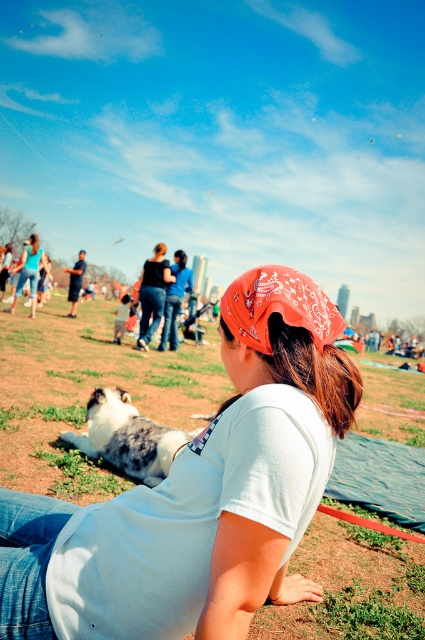
Where is `fluffy gray cat at lower left`? fluffy gray cat at lower left is located at coordinates (127, 436).

Is fluffy gray cat at lower left in front of brown silky hair at center?

No, it is not.

Does point (135, 419) come farther from viewer compared to point (353, 390)?

That is True.

Where is `fluffy gray cat at lower left`? Image resolution: width=425 pixels, height=640 pixels. fluffy gray cat at lower left is located at coordinates (127, 436).

Does point (138, 493) lie in front of point (251, 305)?

Yes, it is.

The image size is (425, 640). Identify the location of white cotton shirt at center. (198, 493).

Identify the location of white cotton shirt at center. The width and height of the screenshot is (425, 640). (198, 493).

Between white cotton shirt at center and brown silky hair at center, which one appears on the right side from the viewer's perspective?

From the viewer's perspective, brown silky hair at center appears more on the right side.

Between white cotton shirt at center and brown silky hair at center, which one has more height?

white cotton shirt at center

Find the location of `white cotton shirt at center`. white cotton shirt at center is located at coordinates (198, 493).

Where is `white cotton shirt at center`? white cotton shirt at center is located at coordinates (198, 493).